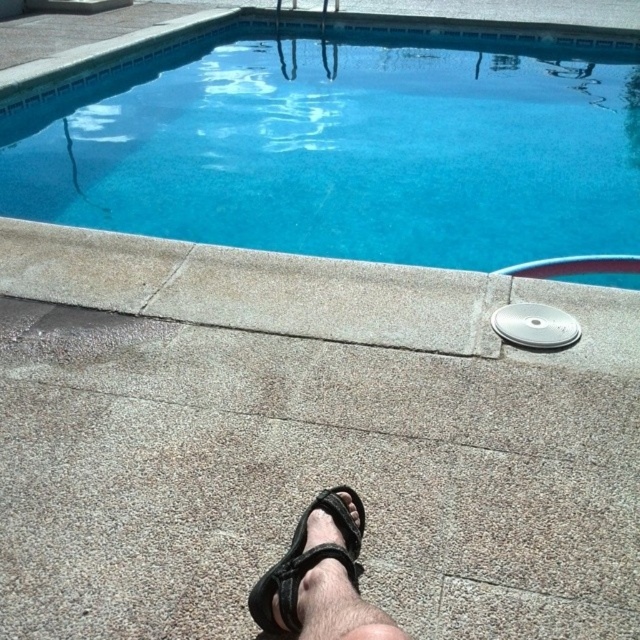
Does blue concrete swimming pool at upper center appear over black fabric sandal at lower center?

Correct, blue concrete swimming pool at upper center is located above black fabric sandal at lower center.

Which is above, blue concrete swimming pool at upper center or black fabric sandal at lower center?

Positioned higher is blue concrete swimming pool at upper center.

Who is more forward, (580,131) or (292,609)?

Point (292,609) is in front.

At what (x,y) coordinates should I click in order to perform the action: click on blue concrete swimming pool at upper center. Please return your answer as a coordinate pair (x, y). This screenshot has width=640, height=640. Looking at the image, I should click on (342, 144).